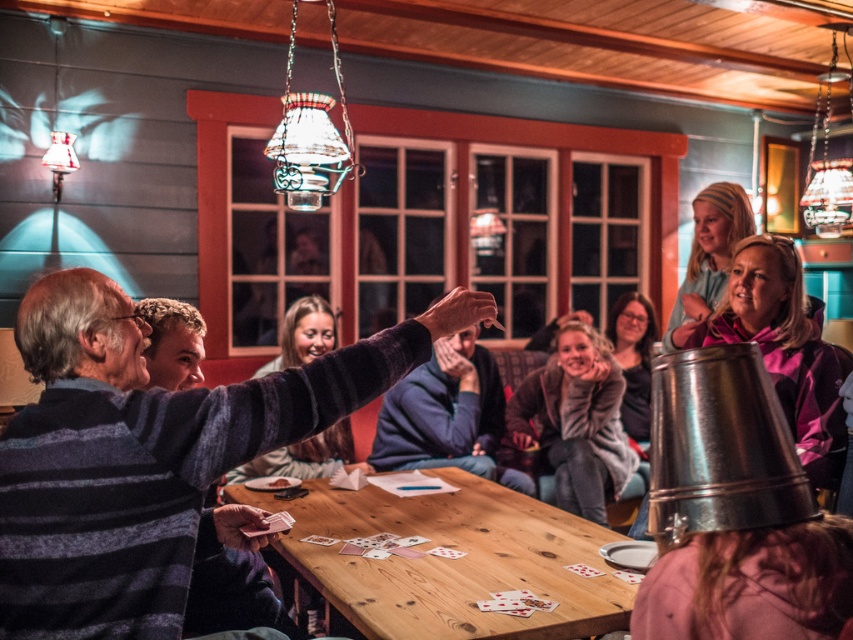
You are standing in the room and want to hand a card to the person wearing the striped sweater at center. Based on their position, where should you approach from to reach them?

The striped sweater at center is located at point 0.720 on the x and 0.178 on the y. Since the coordinates are relative to the image, approaching from the left side would be more direct as the sweater is positioned towards the right side of the image.

Looking at this image, you are a guest at the gathering and want to know which item is positioned higher in the image. Can you tell me if the striped sweater at center is above or below the purple fabric scarf at upper right?

The striped sweater at center is located above the purple fabric scarf at upper right, so it is positioned higher in the image.

You are a guest at this gathering and want to place a small gift on the surface of the wooden table at center. However, there is a striped sweater at center already on the table. Can you still place your gift on the table without moving the sweater?

The striped sweater at center has a greater height compared to wooden table at center. Since the sweater is taller than the table, it is likely placed on top of the table, occupying space. Therefore, you may need to adjust the position of the striped sweater at center to make room for your gift unless there is enough space around it.